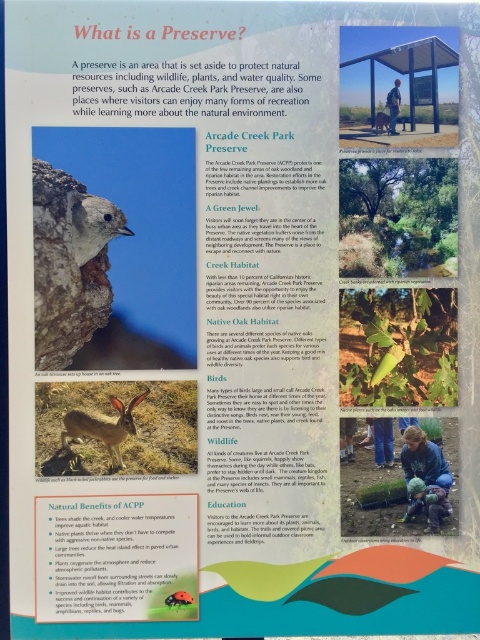
You are a visitor at the Arcade Creek Park Preserve and notice a gray furry bird at upper left and a blue denim jacket at lower right in the informational poster. Which object is closer to you?

The gray furry bird at upper left is closer to you because it is further to the viewer than the blue denim jacket at lower right.